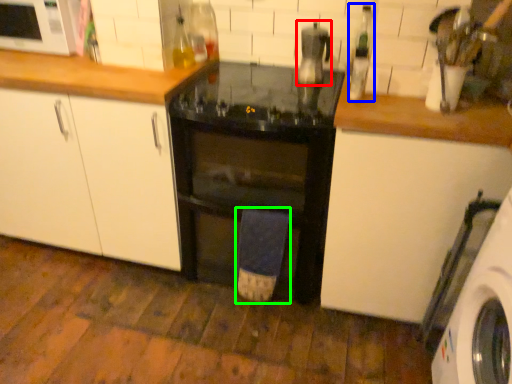
Question: Considering the real-world distances, which object is closest to appliance (highlighted by a red box)? bottle (highlighted by a blue box) or bath towel (highlighted by a green box).

Choices:
 (A) bottle
 (B) bath towel

Answer: (A)